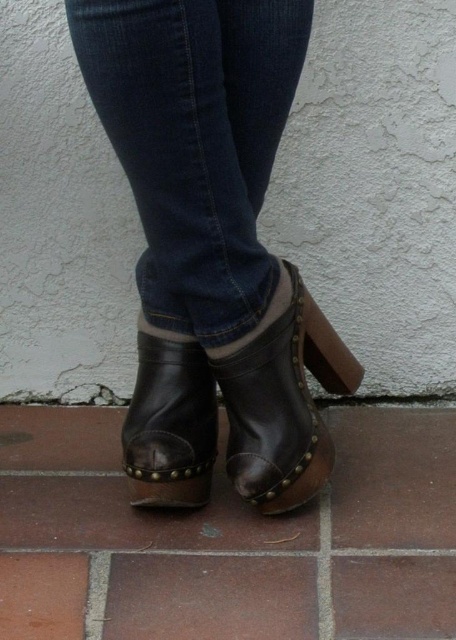
You are trying to decide whether to wear the dark blue denim jeans at center with the leather boot at lower center. Based on their widths, will the jeans be wider than the boot?

The dark blue denim jeans at center is wider than the leather boot at lower center according to the description.

You are a photographer trying to capture the details of both the leather boot at center and the leather boot at lower center. Since you can only focus on one boot at a time, which boot should you adjust your camera focus to first if you want to start with the one closer to the camera?

The leather boot at center is located above the leather boot at lower center, so you should adjust your camera focus to the leather boot at center first since it is closer to the camera.

You are a photographer setting up a shoot focusing on footwear. You need to position a spotlight so that it illuminates the dark blue denim jeans at center and the leather boot at lower center equally. Based on their positions, which object should be placed closer to the light source to ensure both receive the same amount of light?

The leather boot at lower center should be placed closer to the light source because the dark blue denim jeans at center is to the right of the leather boot at lower center, meaning it is farther away and needs more light to achieve equal illumination.